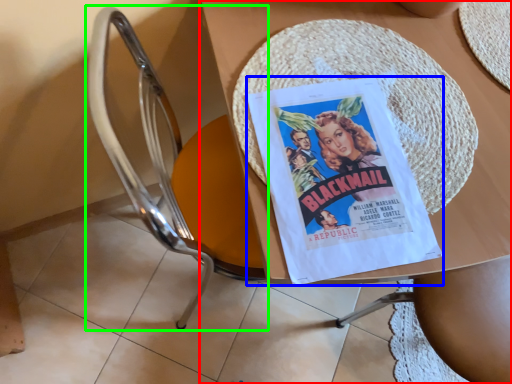
Question: Estimate the real-world distances between objects in this image. Which object is farther from table (highlighted by a red box), comic book (highlighted by a blue box) or chair (highlighted by a green box)?

Choices:
 (A) comic book
 (B) chair

Answer: (B)